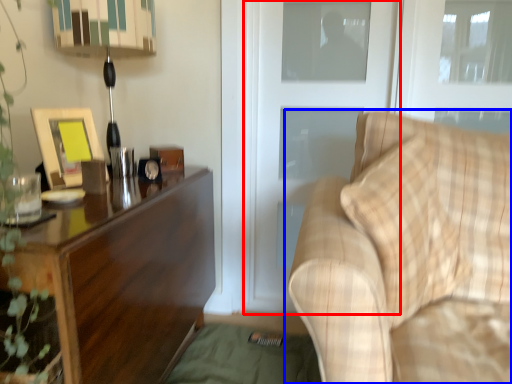
Question: Which object is further to the camera taking this photo, screen door (highlighted by a red box) or studio couch (highlighted by a blue box)?

Choices:
 (A) screen door
 (B) studio couch

Answer: (A)